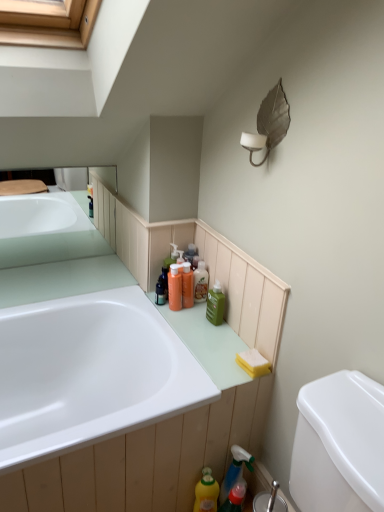
Find the location of a particular element. The image size is (384, 512). free space to the left of orange plastic bottles at center, which is counted as the second toiletry, starting from the right is located at coordinates (142, 298).